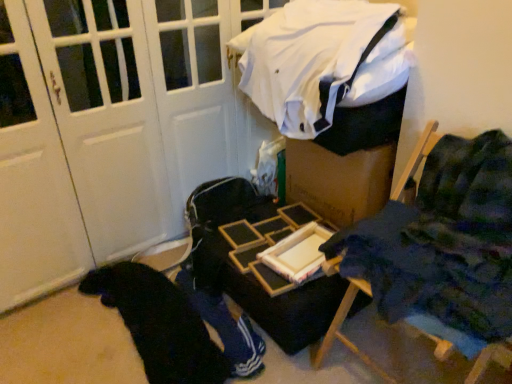
This screenshot has height=384, width=512. Identify the location of free space that is to the left of black fabric at lower left. (58, 334).